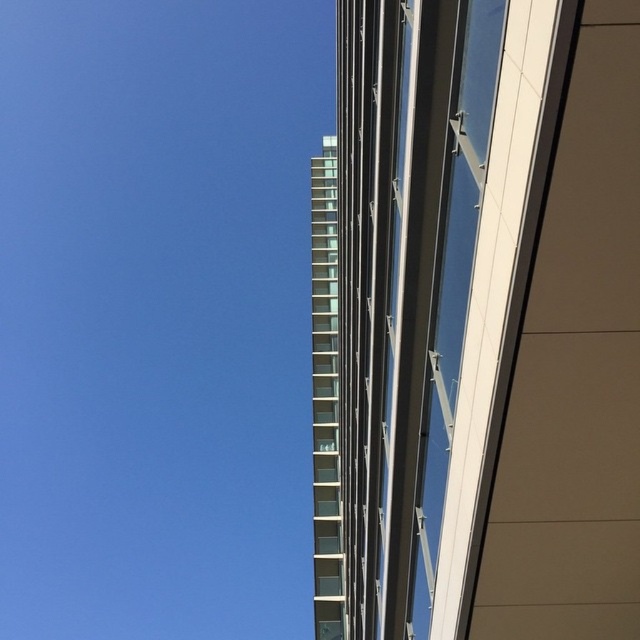
Question: Can you confirm if transparent glass tower at upper center is positioned below clear glass windows at center?

Choices:
 (A) yes
 (B) no

Answer: (A)

Question: Which of the following is the closest to the observer?

Choices:
 (A) (627, 291)
 (B) (314, 500)

Answer: (A)

Question: Does transparent glass tower at upper center have a larger size compared to clear glass windows at center?

Choices:
 (A) no
 (B) yes

Answer: (B)

Question: Is transparent glass tower at upper center to the right of clear glass windows at center from the viewer's perspective?

Choices:
 (A) yes
 (B) no

Answer: (A)